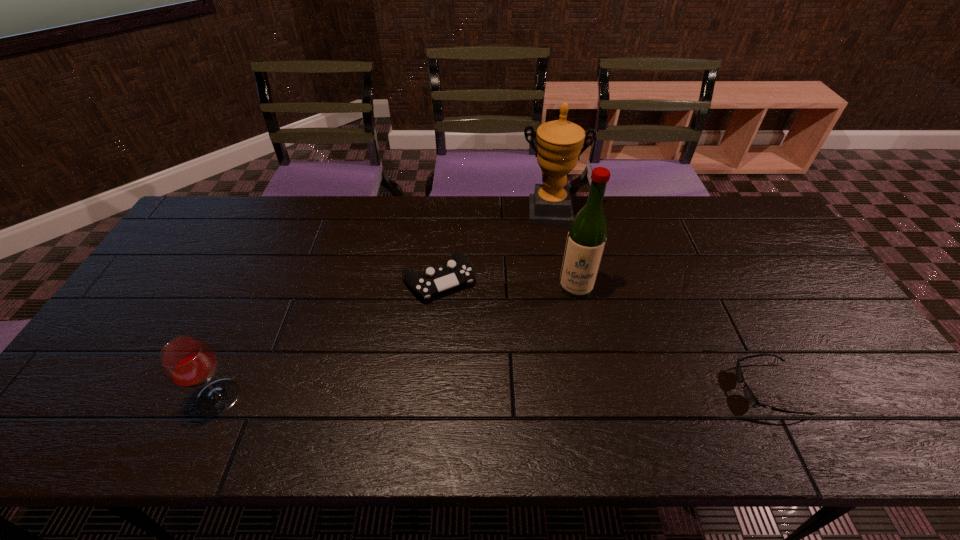
Locate an element on the screen. This screenshot has width=960, height=540. the third tallest object is located at coordinates (188, 361).

Where is `the leftmost object`? The image size is (960, 540). the leftmost object is located at coordinates (188, 361).

The width and height of the screenshot is (960, 540). What are the coordinates of `sunglasses` in the screenshot? It's located at (749, 395).

Where is `the shortest object`? This screenshot has width=960, height=540. the shortest object is located at coordinates (749, 395).

Locate an element on the screen. This screenshot has height=540, width=960. control is located at coordinates (458, 271).

What are the coordinates of `the fourth tallest object` in the screenshot? It's located at (458, 271).

Identify the location of the farthest object. Image resolution: width=960 pixels, height=540 pixels. (559, 142).

Locate an element on the screen. The height and width of the screenshot is (540, 960). liquor is located at coordinates pyautogui.click(x=586, y=239).

This screenshot has width=960, height=540. I want to click on vacant space located 0.350m on the right of the wineglass, so click(x=388, y=397).

Where is `blank area located 0.370m on the front-facing side of the shortest object`? blank area located 0.370m on the front-facing side of the shortest object is located at coordinates (583, 389).